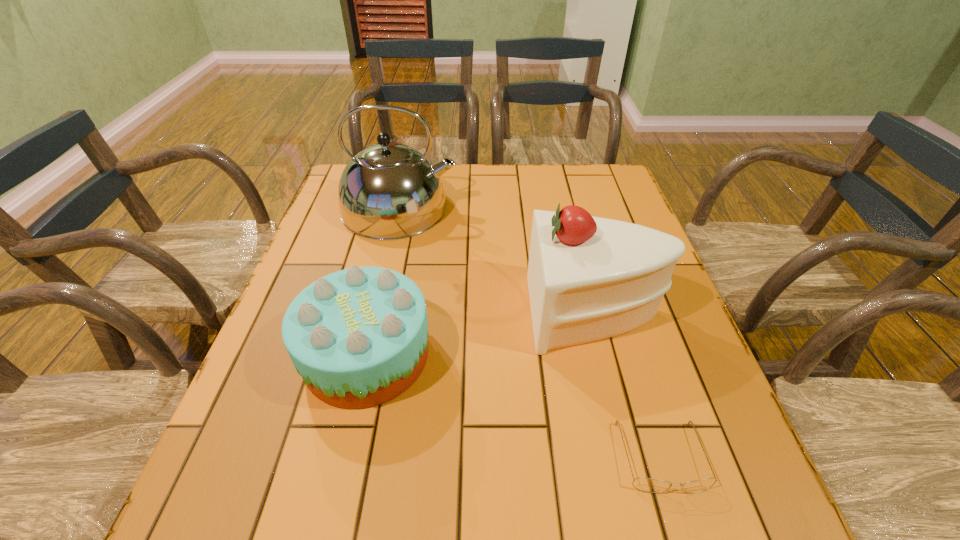
Identify the location of object situated at the near edge. (644, 484).

Where is `kettle that is at the left edge`? The height and width of the screenshot is (540, 960). kettle that is at the left edge is located at coordinates (388, 191).

The height and width of the screenshot is (540, 960). Identify the location of cake situated at the left edge. (358, 337).

Locate an element on the screen. This screenshot has width=960, height=540. cake that is at the right edge is located at coordinates (589, 278).

Locate an element on the screen. The image size is (960, 540). spectacles at the right edge is located at coordinates (644, 484).

I want to click on object at the far left corner, so click(388, 191).

This screenshot has width=960, height=540. What are the coordinates of `object located at the near right corner` in the screenshot? It's located at (644, 484).

Image resolution: width=960 pixels, height=540 pixels. I want to click on free point at the far edge, so click(x=463, y=197).

Find the location of a particular element. free space at the near edge of the desktop is located at coordinates (355, 494).

Where is `vacant region at the left edge of the desktop`? This screenshot has height=540, width=960. vacant region at the left edge of the desktop is located at coordinates (321, 238).